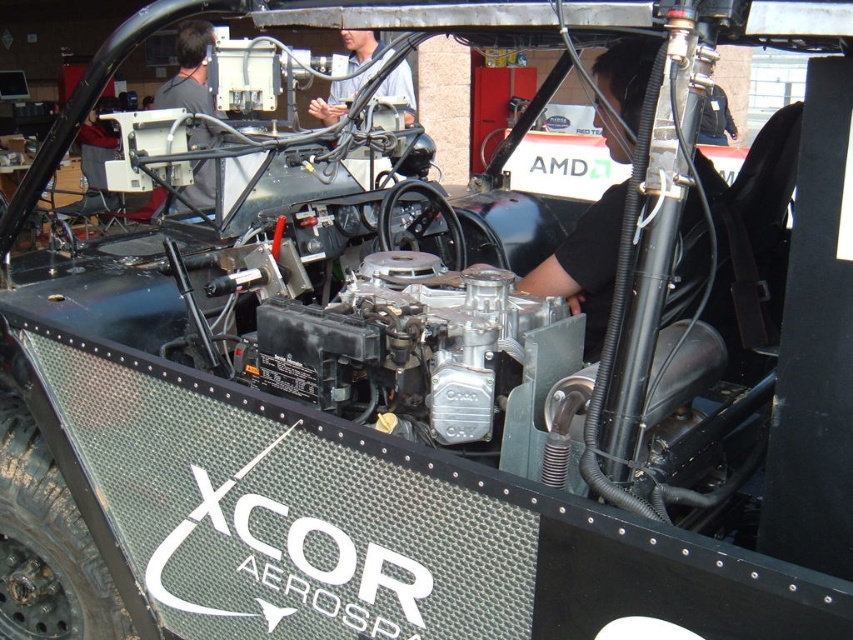
You are a technician working on the XCOR Aerospace vehicle. You need to place a tool that is 1.2 meters tall in the cockpit. Given the black matte shirt at center and the black matte computer at upper left, which object can the tool be placed next to without exceeding its height?

The black matte shirt at center is taller than the black matte computer at upper left. Since the tool is 1.2 meters tall, it should be placed next to the black matte shirt at center as it is taller and can accommodate the height requirement.

You are a technician working on the XCOR Aerospace vehicle. You need to access the engine components located at the front panel of the cockpit. However, there is an obstruction at point (585, 266). What is blocking your access?

The black matte shirt at center is blocking access to the engine components at point (585, 266).

You are a technician working on the XCOR Aerospace vehicle. You need to reach both the black matte shirt at center and the black matte computer at upper left. Which object is closer to you when you are standing at the entrance of the cockpit?

The black matte shirt at center is closer to you than the black matte computer at upper left because it is only 12.32 feet away from the computer, which is farther away.